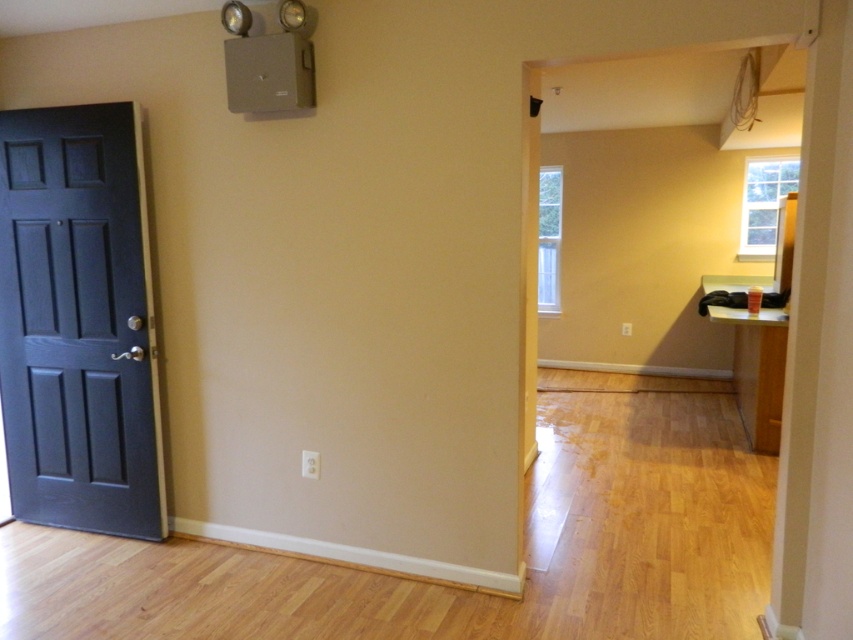
Question: Which of the following is the farthest from the observer?

Choices:
 (A) tap(741, 371)
 (B) tap(93, 292)

Answer: (A)

Question: Does matte black door at left have a lesser width compared to light brown wood table at right?

Choices:
 (A) no
 (B) yes

Answer: (A)

Question: Can you confirm if matte black door at left is positioned to the right of light brown wood table at right?

Choices:
 (A) no
 (B) yes

Answer: (A)

Question: Is the position of matte black door at left less distant than that of light brown wood table at right?

Choices:
 (A) no
 (B) yes

Answer: (B)

Question: Which of the following is the closest to the observer?

Choices:
 (A) (38, 428)
 (B) (755, 387)

Answer: (A)

Question: Which point is closer to the camera?

Choices:
 (A) matte black door at left
 (B) light brown wood table at right

Answer: (A)